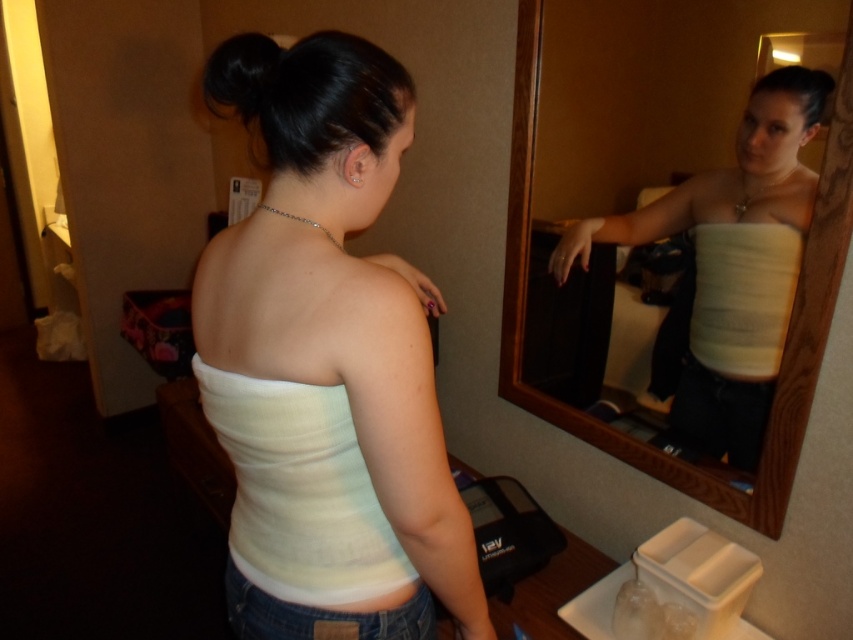
Is white fabric strapless top at upper center shorter than black shiny hair at upper center?

No, white fabric strapless top at upper center is not shorter than black shiny hair at upper center.

Looking at this image, measure the distance from white fabric strapless top at upper center to black shiny hair at upper center.

white fabric strapless top at upper center is 34.14 inches away from black shiny hair at upper center.

Which is behind, point (727, 509) or point (219, 49)?

The point (727, 509) is more distant.

The width and height of the screenshot is (853, 640). Find the location of `white fabric strapless top at upper center`. white fabric strapless top at upper center is located at coordinates (786, 340).

This screenshot has width=853, height=640. In order to click on white matte tank top at center in this screenshot , I will do `click(335, 333)`.

Who is higher up, white matte tank top at center or white fabric strapless top at upper center?

white fabric strapless top at upper center

Which is behind, point (453, 550) or point (525, 144)?

Positioned behind is point (525, 144).

The image size is (853, 640). I want to click on white matte tank top at center, so click(335, 333).

Which is behind, point (378, 637) or point (206, 74)?

Point (378, 637)

Does white matte tank top at center have a greater height compared to black shiny hair at upper center?

Yes.

Who is more distant from viewer, (329, 280) or (248, 125)?

The point (248, 125) is more distant.

Where is `white matte tank top at center`? white matte tank top at center is located at coordinates (335, 333).